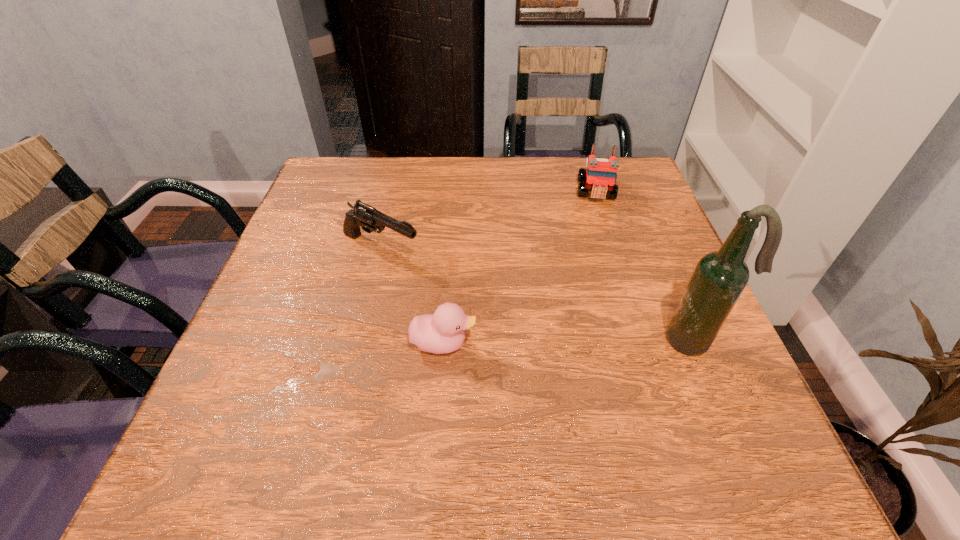
The height and width of the screenshot is (540, 960). Identify the location of empty space that is in between the tallest object and the third nearest object. (538, 295).

At what (x,y) coordinates should I click in order to perform the action: click on empty space between the Lego and the beer bottle. Please return your answer as a coordinate pair (x, y). The height and width of the screenshot is (540, 960). Looking at the image, I should click on pyautogui.click(x=645, y=266).

Identify the location of vacant space in between the duckling and the beer bottle. The height and width of the screenshot is (540, 960). (569, 342).

Find the location of `free point between the tallest object and the duckling`. free point between the tallest object and the duckling is located at coordinates (569, 342).

The height and width of the screenshot is (540, 960). I want to click on free space between the gun and the duckling, so click(412, 296).

What are the coordinates of `vacant area that lies between the gun and the Lego` in the screenshot? It's located at (489, 220).

Find the location of a particular element. vacant region between the farthest object and the beer bottle is located at coordinates (645, 266).

Identify the location of empty location between the farthest object and the beer bottle. The width and height of the screenshot is (960, 540). (645, 266).

Locate an element on the screen. The height and width of the screenshot is (540, 960). empty location between the farthest object and the tallest object is located at coordinates (645, 266).

Where is `empty space between the duckling and the tallest object`? This screenshot has width=960, height=540. empty space between the duckling and the tallest object is located at coordinates (569, 342).